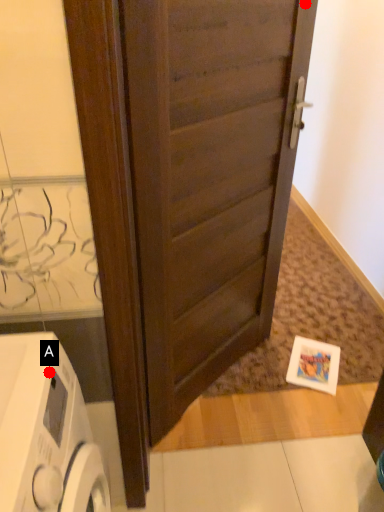
Question: Two points are circled on the image, labeled by A and B beside each circle. Which point is farther from the camera taking this photo?

Choices:
 (A) A is further
 (B) B is further

Answer: (B)